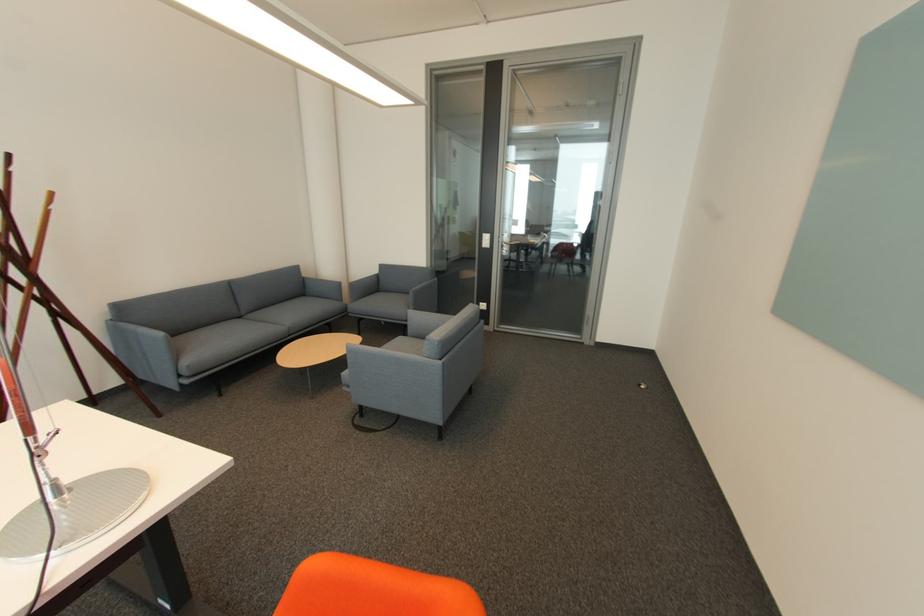
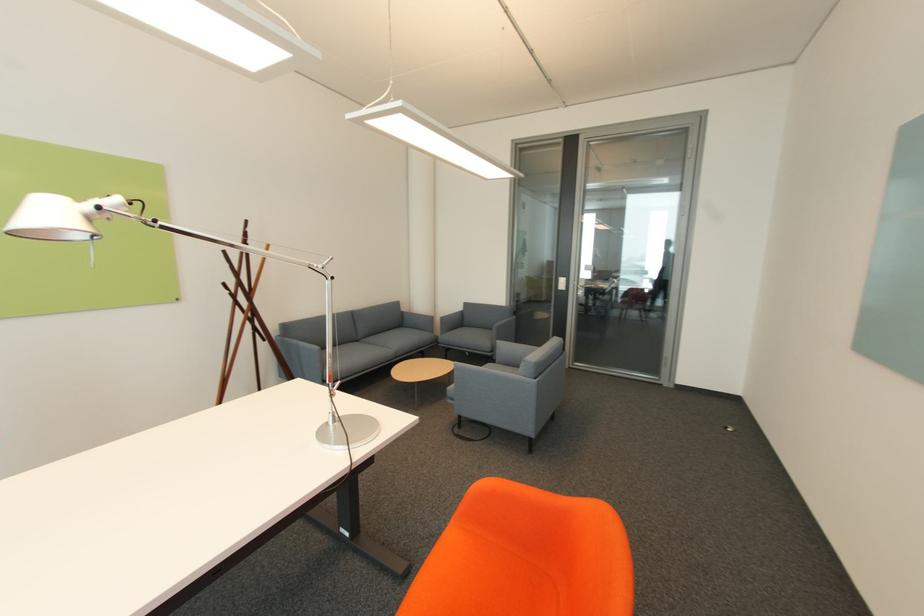
Question: The images are taken continuously from a first-person perspective. In which direction is your viewpoint rotating?

Choices:
 (A) Left
 (B) Right
 (C) Up
 (D) Down

Answer: (A)